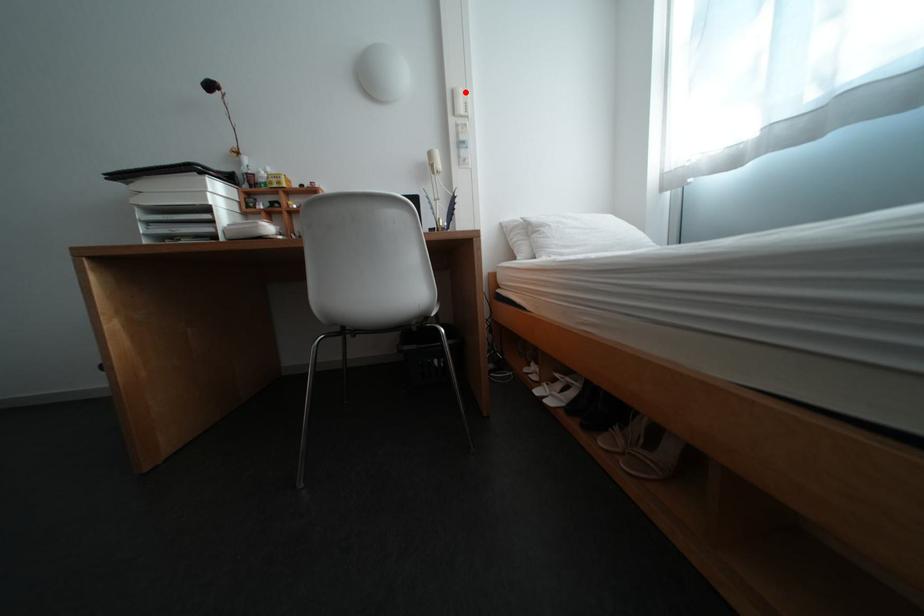
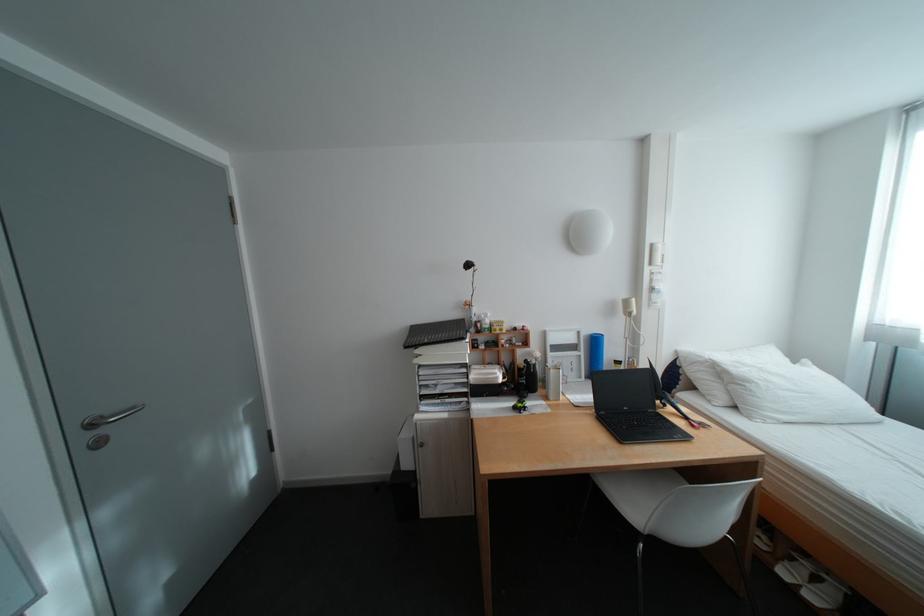
Find the pixel in the second image that matches the highlighted location in the first image.

(664, 246)